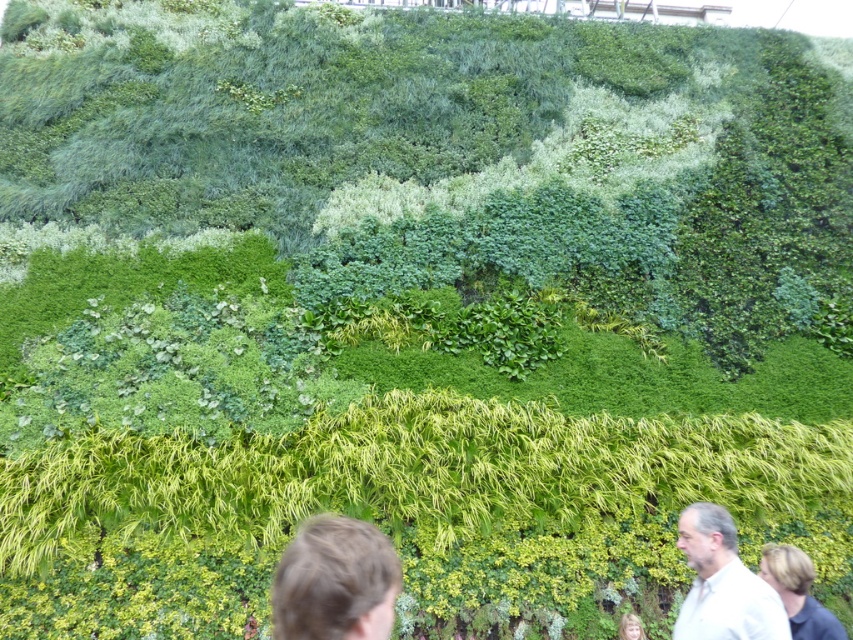
Who is taller, brown hair at lower center or white shirt at lower right?

With more height is white shirt at lower right.

Does brown hair at lower center appear over white shirt at lower right?

Yes.

What do you see at coordinates (335, 580) in the screenshot? Image resolution: width=853 pixels, height=640 pixels. I see `brown hair at lower center` at bounding box center [335, 580].

Find the location of a particular element. This screenshot has height=640, width=853. brown hair at lower center is located at coordinates (335, 580).